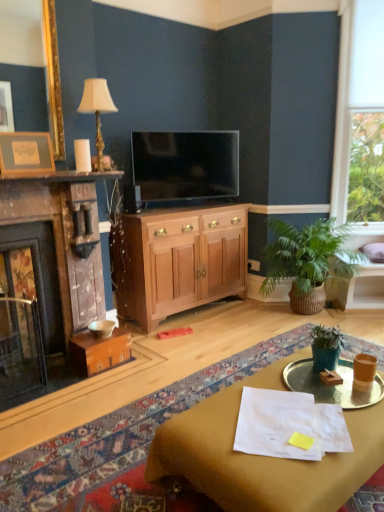
This screenshot has width=384, height=512. In order to click on blank space situated above matte brown desk at lower right (from a real-world perspective) in this screenshot , I will do `click(294, 409)`.